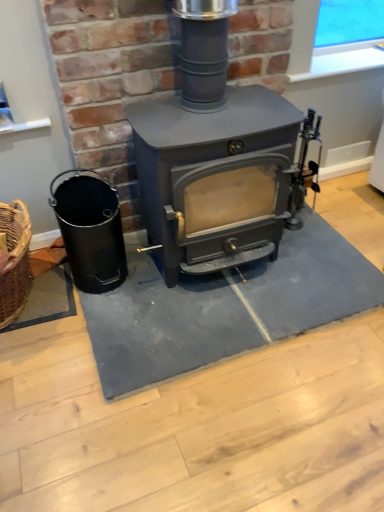
Locate an element on the screen. black matte bucket at left is located at coordinates (90, 231).

Locate an element on the screen. The height and width of the screenshot is (512, 384). matte gray wood burning stove at center is located at coordinates (213, 156).

I want to click on black matte bucket at left, so click(90, 231).

In the scene shown: Does matte gray wood burning stove at center turn towards gray rubber doormat at center?

No.

Does matte gray wood burning stove at center lie behind gray rubber doormat at center?

No, matte gray wood burning stove at center is closer to the camera.

Is matte gray wood burning stove at center bigger or smaller than gray rubber doormat at center?

matte gray wood burning stove at center is bigger than gray rubber doormat at center.

Can you confirm if matte gray wood burning stove at center is taller than black matte bucket at left?

Correct, matte gray wood burning stove at center is much taller as black matte bucket at left.

Would you say black matte bucket at left is part of matte gray wood burning stove at center's contents?

Definitely not — black matte bucket at left is not inside matte gray wood burning stove at center.

Are matte gray wood burning stove at center and black matte bucket at left making contact?

No, matte gray wood burning stove at center is not touching black matte bucket at left.

Looking at this image, considering the relative sizes of black matte bucket at left and gray rubber doormat at center in the image provided, is black matte bucket at left smaller than gray rubber doormat at center?

Correct, black matte bucket at left occupies less space than gray rubber doormat at center.

Does point (90, 236) come behind point (113, 344)?

Yes, it is behind point (113, 344).

Is gray rubber doormat at center a part of black matte bucket at left?

That's incorrect, gray rubber doormat at center is not inside black matte bucket at left.

Identify the location of appliance above the gray rubber doormat at center (from a real-world perspective). (90, 231).

Looking at this image, which object is positioned more to the right, black matte bucket at left or matte gray wood burning stove at center?

From the viewer's perspective, matte gray wood burning stove at center appears more on the right side.

Is black matte bucket at left wider than matte gray wood burning stove at center?

In fact, black matte bucket at left might be narrower than matte gray wood burning stove at center.

This screenshot has width=384, height=512. Find the location of `wood burning stove above the black matte bucket at left (from the image's perspective)`. wood burning stove above the black matte bucket at left (from the image's perspective) is located at coordinates (213, 156).

Which of these two, black matte bucket at left or matte gray wood burning stove at center, is smaller?

Smaller between the two is black matte bucket at left.

From the picture: Which object is positioned more to the right, gray rubber doormat at center or matte gray wood burning stove at center?

gray rubber doormat at center.

Can you confirm if gray rubber doormat at center is wider than matte gray wood burning stove at center?

Correct, the width of gray rubber doormat at center exceeds that of matte gray wood burning stove at center.

Who is more distant, gray rubber doormat at center or matte gray wood burning stove at center?

gray rubber doormat at center is further away from the camera.

Is gray rubber doormat at center not inside matte gray wood burning stove at center?

Yes, gray rubber doormat at center is located beyond the bounds of matte gray wood burning stove at center.

Between point (290, 321) and point (79, 186), which one is positioned behind?

The point (79, 186) is behind.

Is gray rubber doormat at center at the left side of black matte bucket at left?

No, gray rubber doormat at center is not to the left of black matte bucket at left.

Is gray rubber doormat at center oriented away from black matte bucket at left?

gray rubber doormat at center is not turned away from black matte bucket at left.

From a real-world perspective, is gray rubber doormat at center over black matte bucket at left?

Actually, gray rubber doormat at center is physically below black matte bucket at left in the real world.

At what (x,y) coordinates should I click in order to perform the action: click on doormat that appears below the matte gray wood burning stove at center (from a real-world perspective). Please return your answer as a coordinate pair (x, y). Looking at the image, I should click on (224, 307).

Where is `appliance located on the left of matte gray wood burning stove at center`? The height and width of the screenshot is (512, 384). appliance located on the left of matte gray wood burning stove at center is located at coordinates (90, 231).

Which object lies further to the anchor point matte gray wood burning stove at center, black matte bucket at left or gray rubber doormat at center?

gray rubber doormat at center lies further to matte gray wood burning stove at center than the other object.

Based on the photo, when comparing their distances from black matte bucket at left, does gray rubber doormat at center or matte gray wood burning stove at center seem closer?

Among the two, gray rubber doormat at center is located nearer to black matte bucket at left.

Based on their spatial positions, is black matte bucket at left or matte gray wood burning stove at center closer to gray rubber doormat at center?

Based on the image, black matte bucket at left appears to be nearer to gray rubber doormat at center.

When comparing their distances from gray rubber doormat at center, does matte gray wood burning stove at center or black matte bucket at left seem further?

matte gray wood burning stove at center lies further to gray rubber doormat at center than the other object.

From the image, which object appears to be farther from black matte bucket at left, matte gray wood burning stove at center or gray rubber doormat at center?

matte gray wood burning stove at center lies further to black matte bucket at left than the other object.

Looking at the image, which one is located further to matte gray wood burning stove at center, gray rubber doormat at center or black matte bucket at left?

Among the two, gray rubber doormat at center is located further to matte gray wood burning stove at center.

At what (x,y) coordinates should I click in order to perform the action: click on wood burning stove between black matte bucket at left and gray rubber doormat at center in the horizontal direction. Please return your answer as a coordinate pair (x, y). The width and height of the screenshot is (384, 512). Looking at the image, I should click on (213, 156).